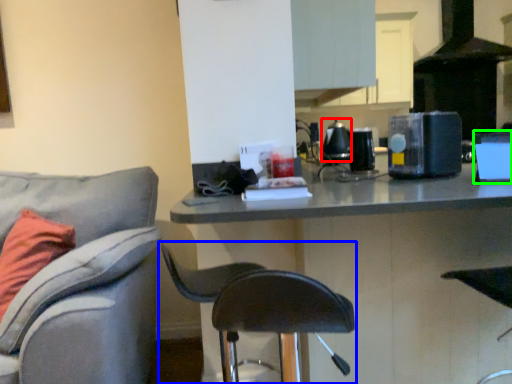
Question: Estimate the real-world distances between objects in this image. Which object is closer to appliance (highlighted by a red box), chair (highlighted by a blue box) or appliance (highlighted by a green box)?

Choices:
 (A) chair
 (B) appliance

Answer: (B)